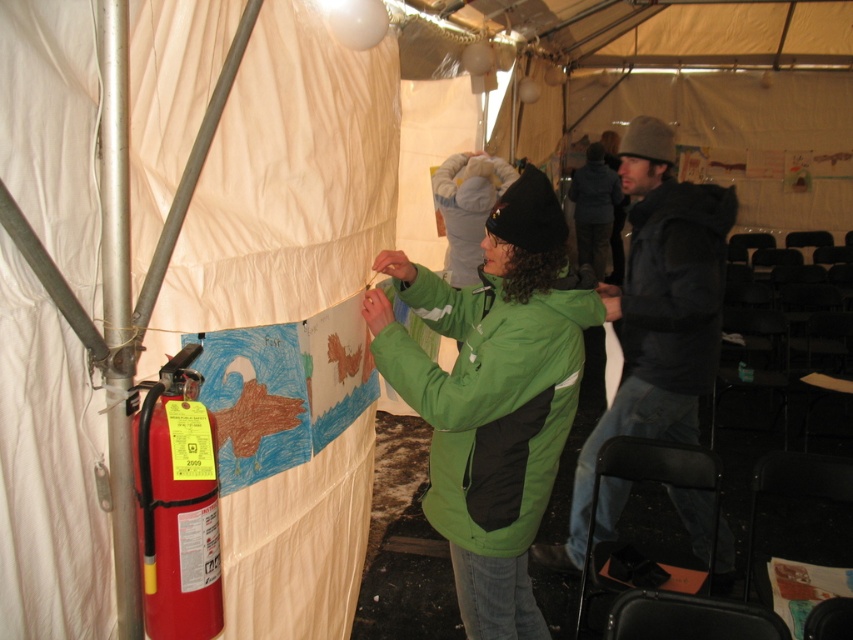
Does green/waterproof jacket at center lie behind black matte jacket at right?

No, it is in front of black matte jacket at right.

Can you confirm if green/waterproof jacket at center is positioned to the right of black matte jacket at right?

No, green/waterproof jacket at center is not to the right of black matte jacket at right.

Who is more forward, (439, 456) or (700, 204)?

Point (439, 456) is in front.

The height and width of the screenshot is (640, 853). In order to click on green/waterproof jacket at center in this screenshot , I will do `click(491, 400)`.

Is green/waterproof jacket at center to the right of red matte fire extinguisher at lower left from the viewer's perspective?

Indeed, green/waterproof jacket at center is positioned on the right side of red matte fire extinguisher at lower left.

Based on the photo, between green/waterproof jacket at center and red matte fire extinguisher at lower left, which one has more height?

green/waterproof jacket at center is taller.

What do you see at coordinates (491, 400) in the screenshot? I see `green/waterproof jacket at center` at bounding box center [491, 400].

Locate an element on the screen. Image resolution: width=853 pixels, height=640 pixels. green/waterproof jacket at center is located at coordinates (491, 400).

Locate an element on the screen. The height and width of the screenshot is (640, 853). red matte fire extinguisher at lower left is located at coordinates (177, 506).

From the picture: Is red matte fire extinguisher at lower left further to the viewer compared to black matte jacket at right?

No, red matte fire extinguisher at lower left is in front of black matte jacket at right.

At what (x,y) coordinates should I click in order to perform the action: click on red matte fire extinguisher at lower left. Please return your answer as a coordinate pair (x, y). Image resolution: width=853 pixels, height=640 pixels. Looking at the image, I should click on (177, 506).

At what (x,y) coordinates should I click in order to perform the action: click on red matte fire extinguisher at lower left. Please return your answer as a coordinate pair (x, y). Looking at the image, I should click on (177, 506).